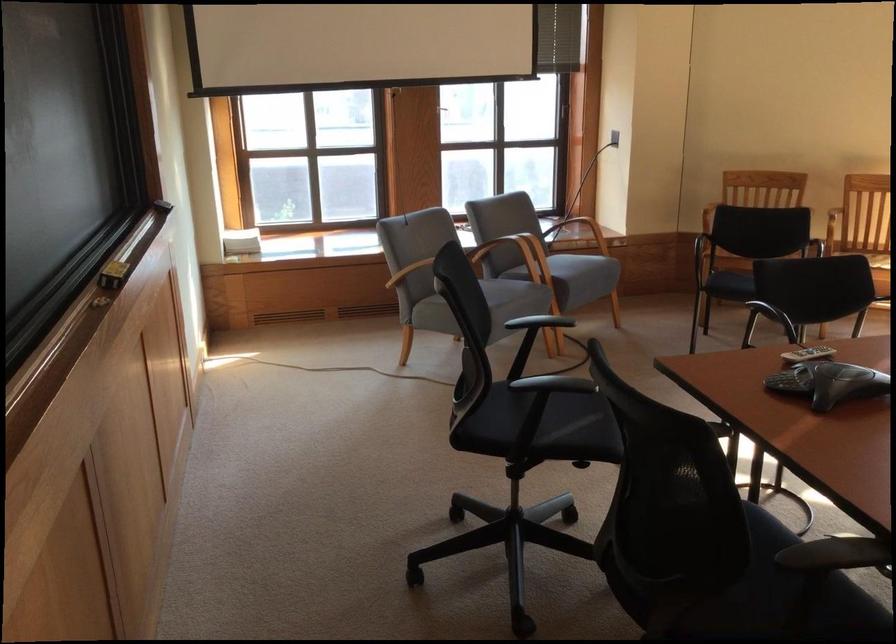
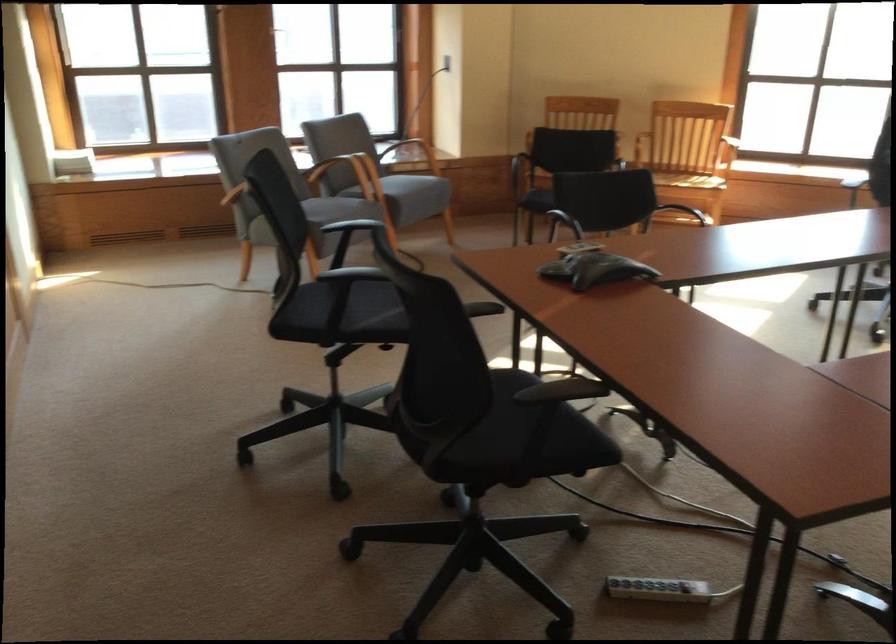
Where in the second image is the point corresponding to point (576, 275) from the first image?

(410, 194)